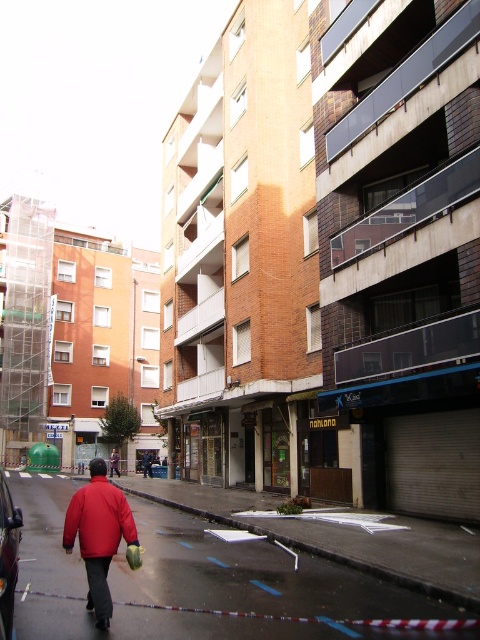
Question: Is concrete pavement at center thinner than shiny black car at lower left?

Choices:
 (A) yes
 (B) no

Answer: (B)

Question: Which object appears farthest from the camera in this image?

Choices:
 (A) concrete pavement at center
 (B) dark blue jeans at center
 (C) matte red jacket at center
 (D) red fabric jacket at lower left

Answer: (D)

Question: In this image, where is red matte jacket at lower left located relative to dark blue jeans at center?

Choices:
 (A) below
 (B) above

Answer: (B)

Question: Which object appears farthest from the camera in this image?

Choices:
 (A) concrete pavement at center
 (B) matte red jacket at center

Answer: (B)

Question: Among these objects, which one is nearest to the camera?

Choices:
 (A) red matte jacket at lower left
 (B) shiny black car at lower left
 (C) concrete pavement at center

Answer: (B)

Question: Observing the image, what is the correct spatial positioning of matte red jacket at center in reference to dark blue jeans at center?

Choices:
 (A) below
 (B) above

Answer: (B)